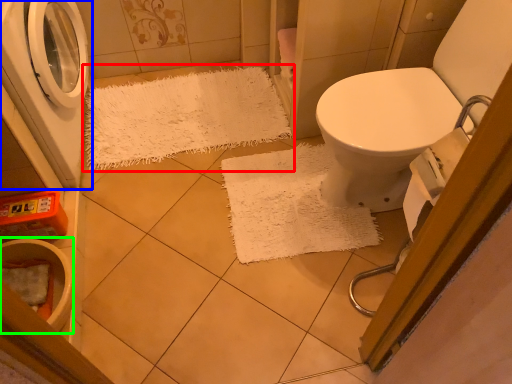
Question: Considering the real-world distances, which object is closest to doormat (highlighted by a red box)? washing machine (highlighted by a blue box) or toilet bowl (highlighted by a green box).

Choices:
 (A) washing machine
 (B) toilet bowl

Answer: (A)